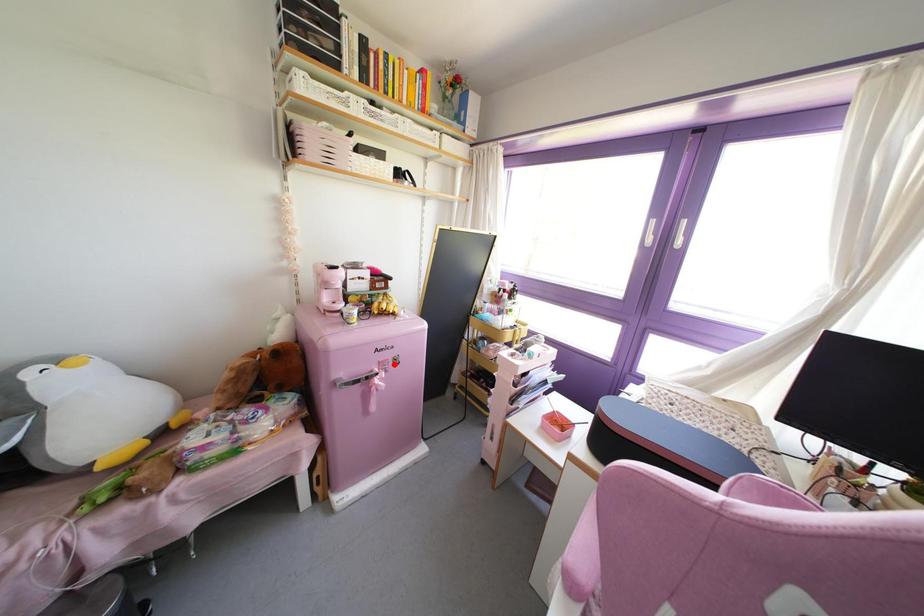
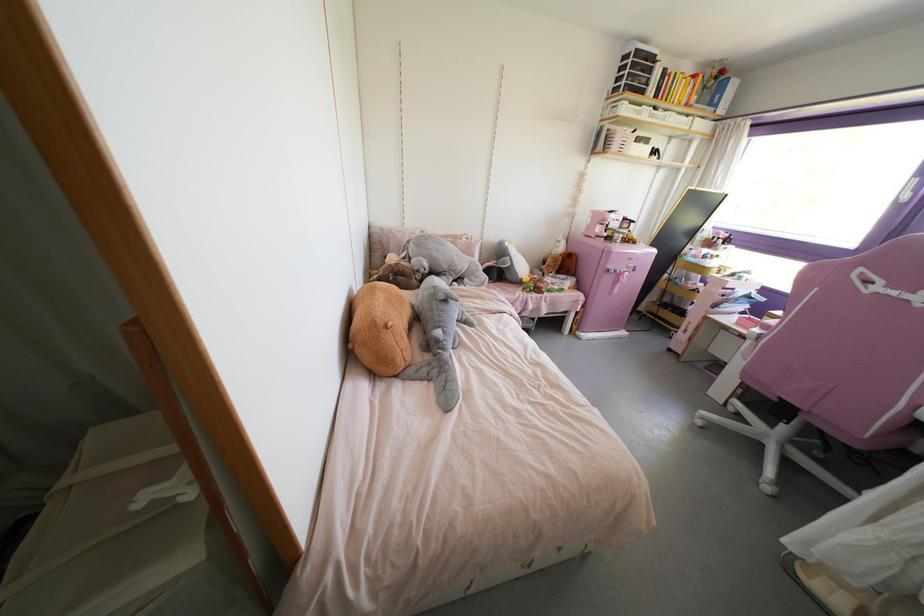
Question: I am providing you with two images of the same scene from different viewpoints. A red point is shown in image1. For the corresponding object point in image2, is it positioned nearer or farther from the camera?

Choices:
 (A) Nearer
 (B) Farther

Answer: (A)